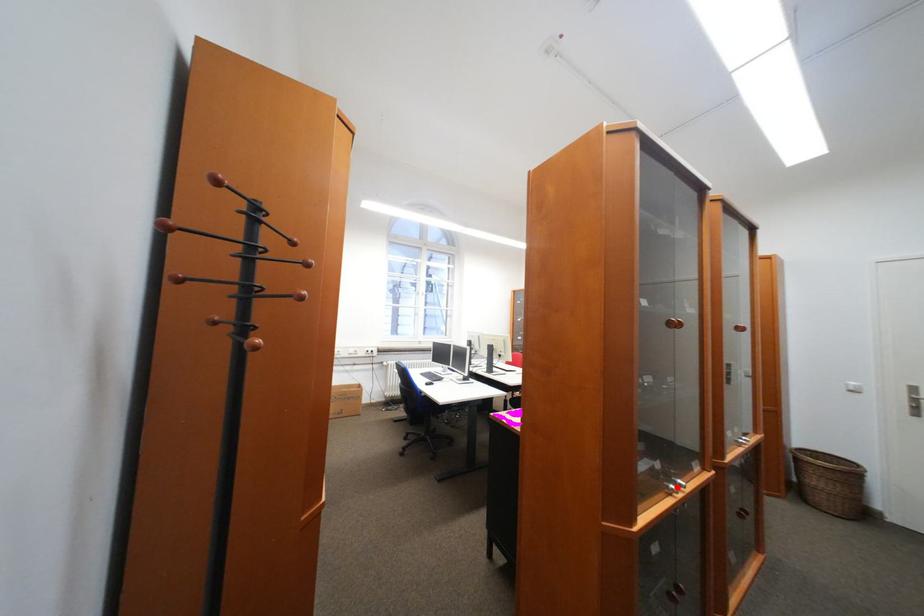
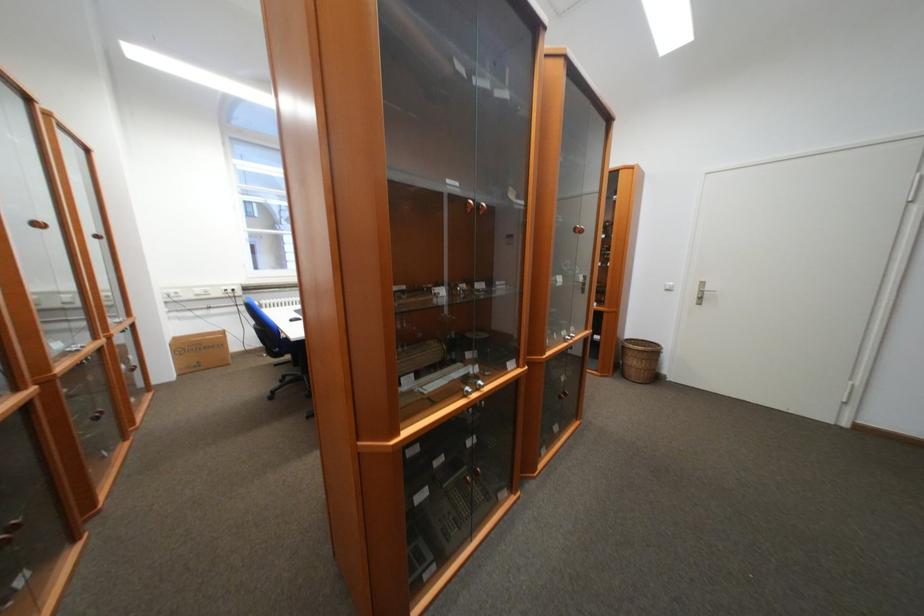
The point at the highlighted location is marked in the first image. Where is the corresponding point in the second image?

(472, 390)